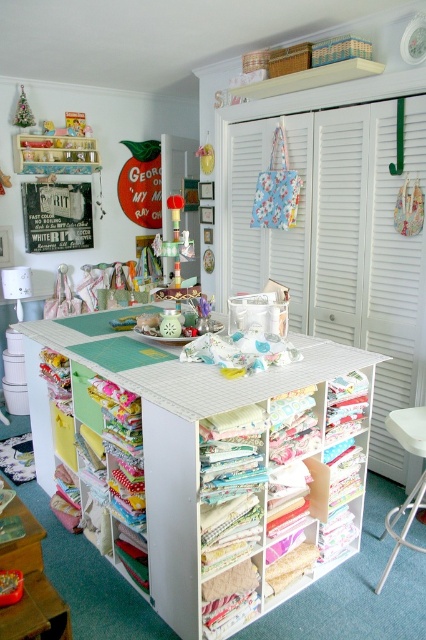
Between translucent plastic toy at center and yellow fabric drawer at lower left, which one has less height?

yellow fabric drawer at lower left

Is point (178, 221) positioned after point (69, 460)?

Yes.

Find the location of `translucent plastic toy at center`. translucent plastic toy at center is located at coordinates (175, 241).

Between white plastic stool at lower right and yellow fabric drawer at lower left, which one is positioned higher?

yellow fabric drawer at lower left is higher up.

Is white plastic stool at lower right to the right of yellow fabric drawer at lower left from the viewer's perspective?

Correct, you'll find white plastic stool at lower right to the right of yellow fabric drawer at lower left.

What do you see at coordinates (403, 525) in the screenshot? The height and width of the screenshot is (640, 426). I see `white plastic stool at lower right` at bounding box center [403, 525].

I want to click on white plastic stool at lower right, so click(x=403, y=525).

Can you confirm if white fabric-covered table at center is taller than metallic silver sign at upper left?

Indeed, white fabric-covered table at center has a greater height compared to metallic silver sign at upper left.

Is white fabric-covered table at center to the right of metallic silver sign at upper left from the viewer's perspective?

Yes, white fabric-covered table at center is to the right of metallic silver sign at upper left.

Identify the location of white fabric-covered table at center. (207, 465).

What are the coordinates of `white fabric-covered table at center` in the screenshot? It's located at (207, 465).